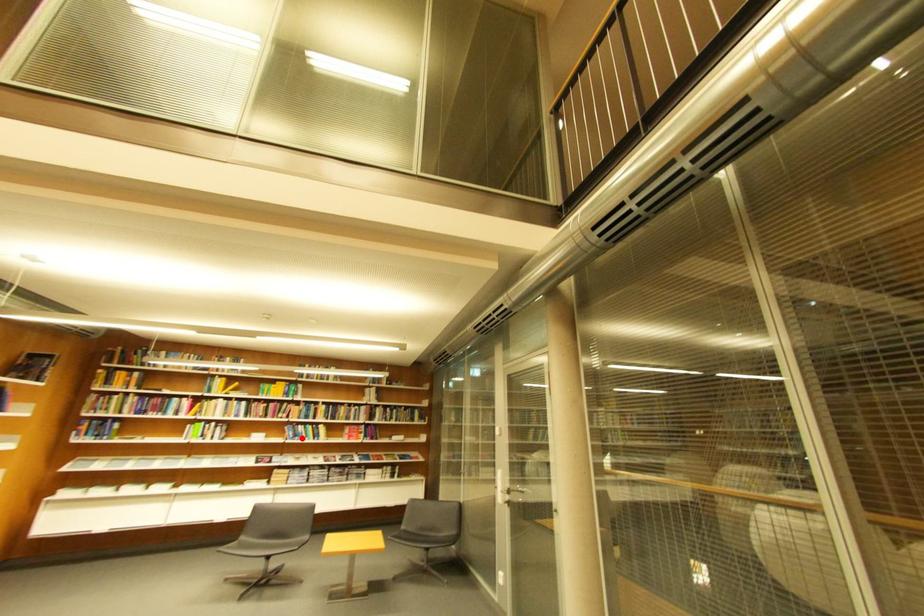
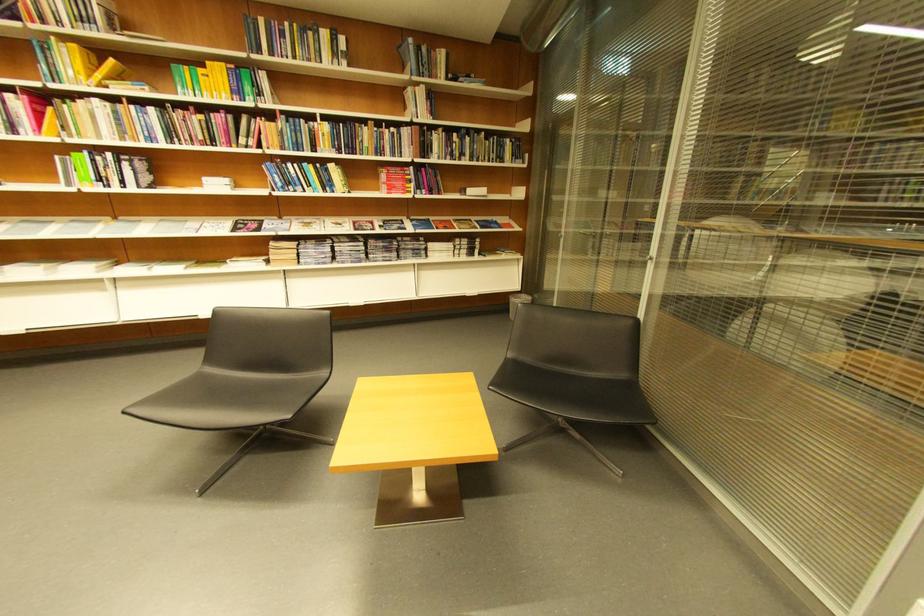
Where in the second image is the point corresponding to the highlighted location from the first image?

(290, 185)